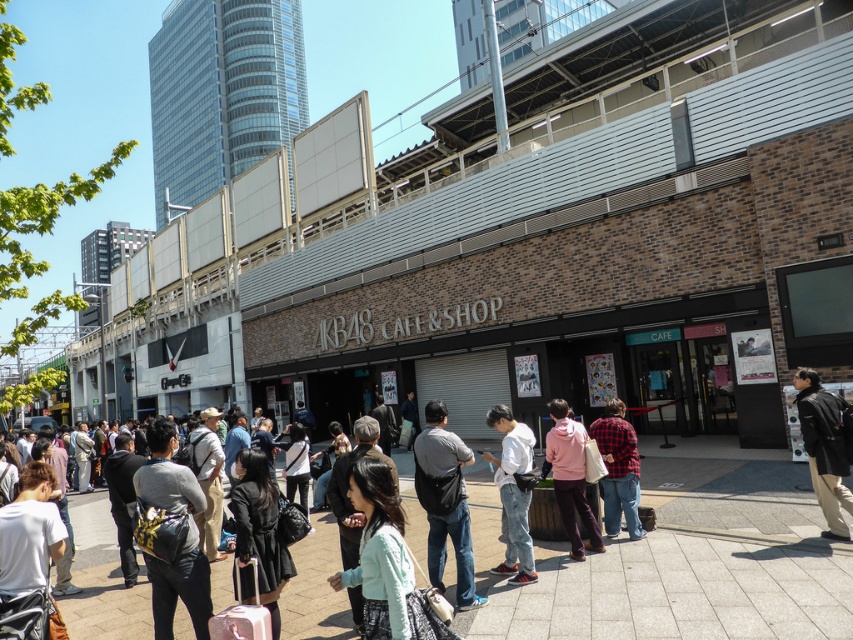
Between black leather jacket at lower right and pink fleece jacket at center, which one appears on the left side from the viewer's perspective?

Positioned to the left is pink fleece jacket at center.

Can you confirm if black leather jacket at lower right is thinner than pink fleece jacket at center?

Yes, black leather jacket at lower right is thinner than pink fleece jacket at center.

This screenshot has height=640, width=853. What do you see at coordinates (822, 449) in the screenshot?
I see `black leather jacket at lower right` at bounding box center [822, 449].

The width and height of the screenshot is (853, 640). What are the coordinates of `black leather jacket at lower right` in the screenshot? It's located at (822, 449).

Between point (276, 625) and point (817, 406), which one is positioned behind?

The point (817, 406) is more distant.

I want to click on black leather coat at center, so click(258, 532).

Can you confirm if light gray concrete pavement at center is wider than black leather coat at center?

Yes, light gray concrete pavement at center is wider than black leather coat at center.

Does light gray concrete pavement at center appear under black leather coat at center?

Correct, light gray concrete pavement at center is located below black leather coat at center.

Locate an element on the screen. light gray concrete pavement at center is located at coordinates (680, 561).

Locate an element on the screen. The height and width of the screenshot is (640, 853). light gray concrete pavement at center is located at coordinates (680, 561).